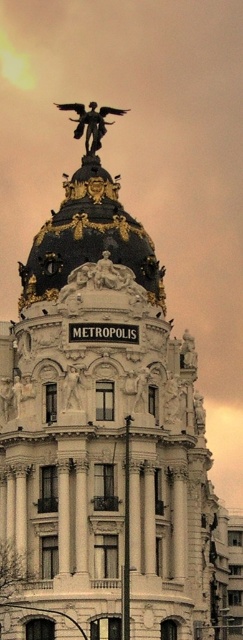
You are standing in front of the Metropolis building and want to locate the golden statue. According to the image, where exactly is the point at coordinates (90, 122) located?

The point at coordinates (90, 122) is located on the bronze golden statue at top center.